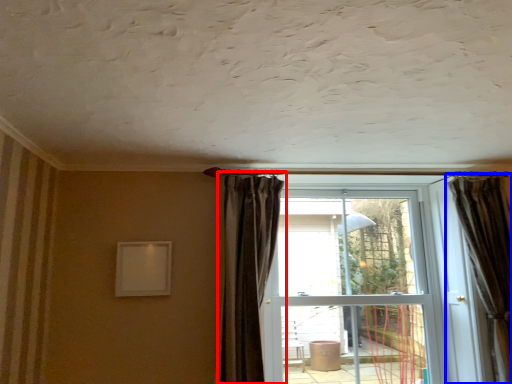
Question: Which object is closer to the camera taking this photo, curtain (highlighted by a red box) or curtain (highlighted by a blue box)?

Choices:
 (A) curtain
 (B) curtain

Answer: (A)